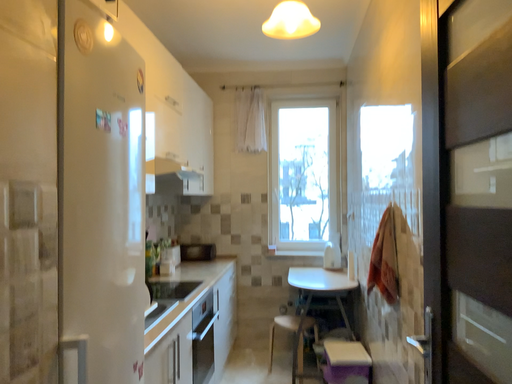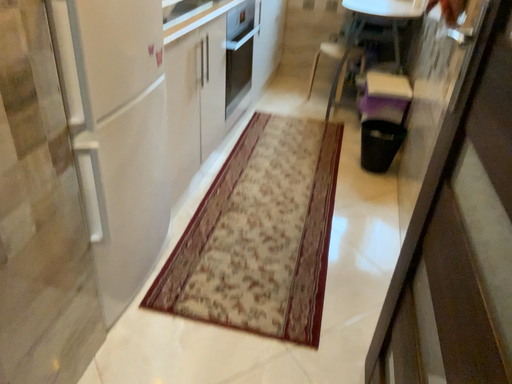
Question: Which way did the camera rotate in the video?

Choices:
 (A) rotated right
 (B) rotated left

Answer: (B)